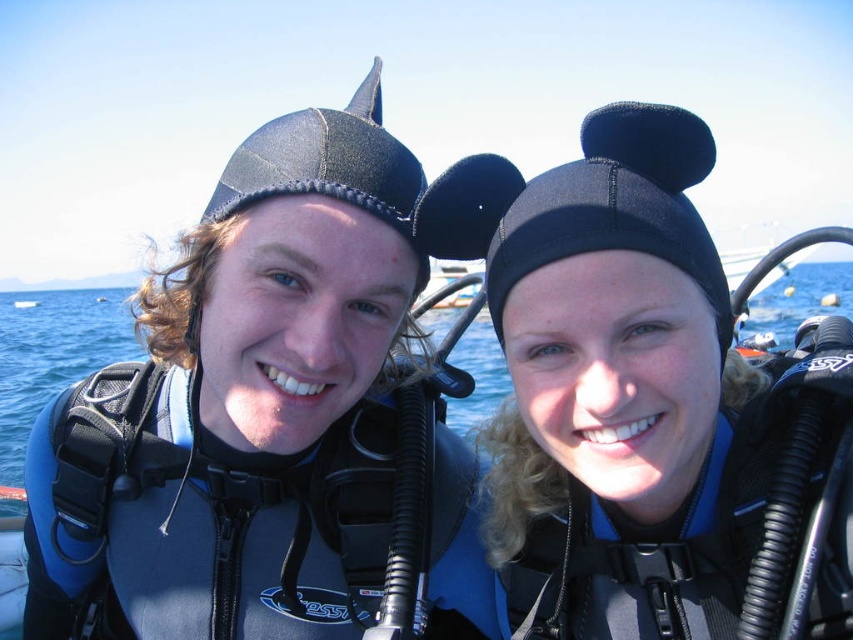
You are a photographer trying to capture the scene with the black neoprene swim cap at center and the blue matte water at center. Which object is positioned to the right side of the other?

The black neoprene swim cap at center is to the right of the blue matte water at center.

You are a photographer positioned at the origin point of the image. You want to capture a photo where the black neoprene swim cap at center is centered in the frame. According to the coordinates provided, in which direction should you adjust your camera to align the swim cap at the center?

The black neoprene swim cap at center is located at point 0.648 on the x axis and 0.770 on the y axis. Since the origin is at the bottom left corner, to center it, you should move the camera to the right along the x axis and upwards along the y axis.